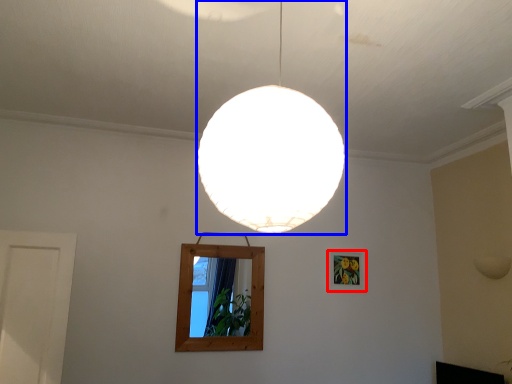
Question: Among these objects, which one is farthest to the camera, picture frame (highlighted by a red box) or lamp (highlighted by a blue box)?

Choices:
 (A) picture frame
 (B) lamp

Answer: (A)